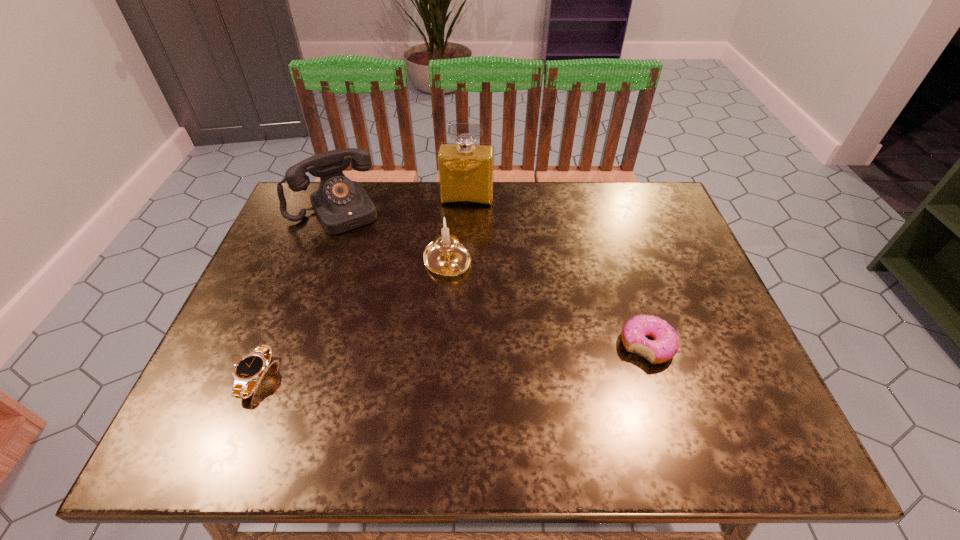
Identify which object is located as the nearest to the shortest object. Please provide its 2D coordinates. Your answer should be formatted as a tuple, i.e. [(x, y)], where the tuple contains the x and y coordinates of a point satisfying the conditions above.

[(445, 256)]

I want to click on free spot that satisfies the following two spatial constraints: 1. on the back side of the third farthest object; 2. on the right side of the tallest object, so click(x=452, y=200).

Where is `free space that satisfies the following two spatial constraints: 1. on the back side of the watch; 2. on the left side of the tallest object`? free space that satisfies the following two spatial constraints: 1. on the back side of the watch; 2. on the left side of the tallest object is located at coordinates (327, 200).